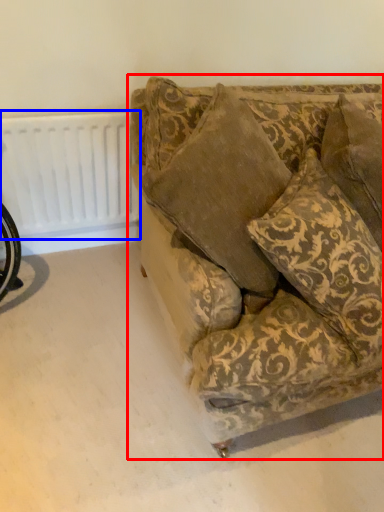
Question: Which point is further to the camera, studio couch (highlighted by a red box) or radiator (highlighted by a blue box)?

Choices:
 (A) studio couch
 (B) radiator

Answer: (B)